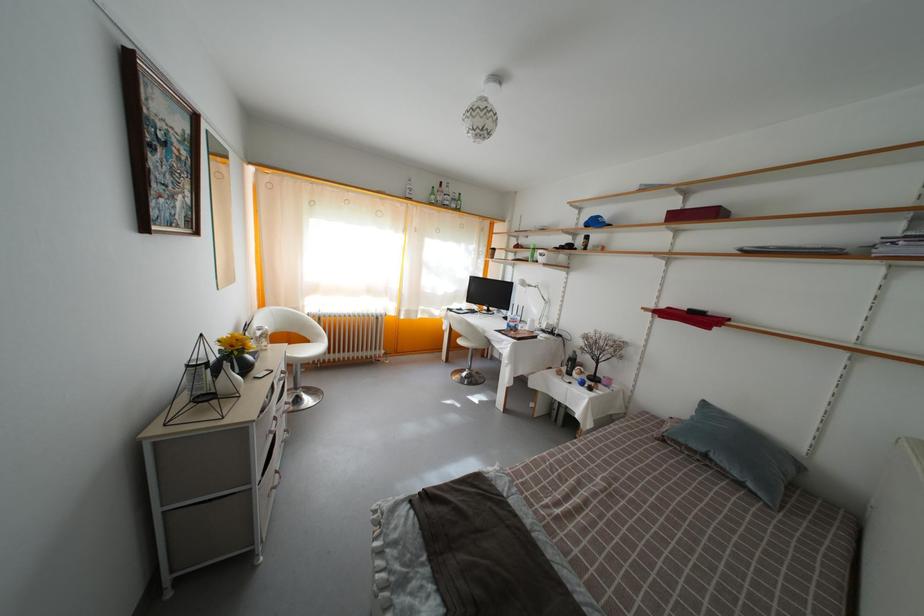
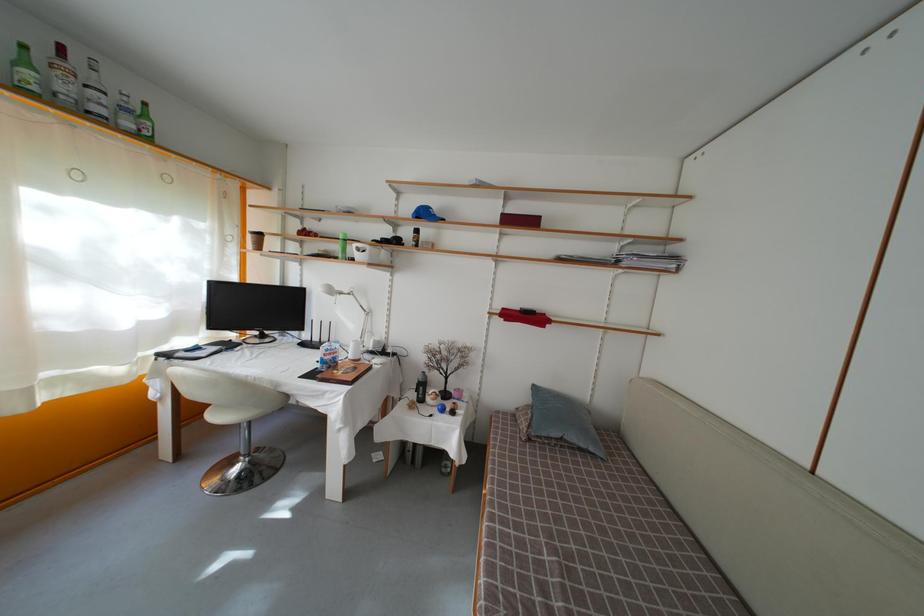
Find the pixel in the second image that matches (466,347) in the first image.

(221, 422)